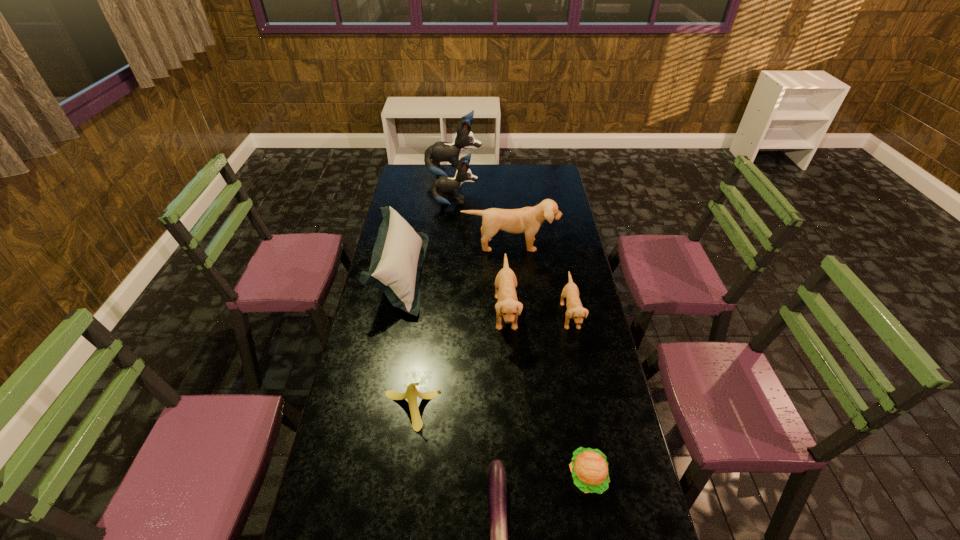
At what (x,y) coordinates should I click in order to perform the action: click on the eighth tallest object. Please return your answer as a coordinate pair (x, y). Looking at the image, I should click on (589, 467).

This screenshot has width=960, height=540. In order to click on vacant space located on the front-facing side of the bigger black puppy in this screenshot , I will do `click(494, 176)`.

This screenshot has width=960, height=540. Identify the location of vacant position located 0.230m on the front-facing side of the smaller black puppy. (522, 203).

Where is `free location located 0.170m on the left side of the farthest beige puppy`? Image resolution: width=960 pixels, height=540 pixels. free location located 0.170m on the left side of the farthest beige puppy is located at coordinates (513, 280).

Where is `free space located on the surface of the cushion`? The width and height of the screenshot is (960, 540). free space located on the surface of the cushion is located at coordinates (444, 274).

Image resolution: width=960 pixels, height=540 pixels. I want to click on vacant space located 0.330m on the left side of the second shortest puppy, so click(x=410, y=312).

Identify the location of free region located 0.070m on the left side of the second shortest puppy. This screenshot has width=960, height=540. (475, 312).

The height and width of the screenshot is (540, 960). Identify the location of vacant space positioned on the left side of the second shortest puppy. (443, 312).

This screenshot has width=960, height=540. In order to click on free region located 0.150m on the left side of the smallest beige puppy in this screenshot , I will do `click(522, 316)`.

Where is `vacant space located 0.160m on the left side of the smallest beige puppy`? vacant space located 0.160m on the left side of the smallest beige puppy is located at coordinates (519, 316).